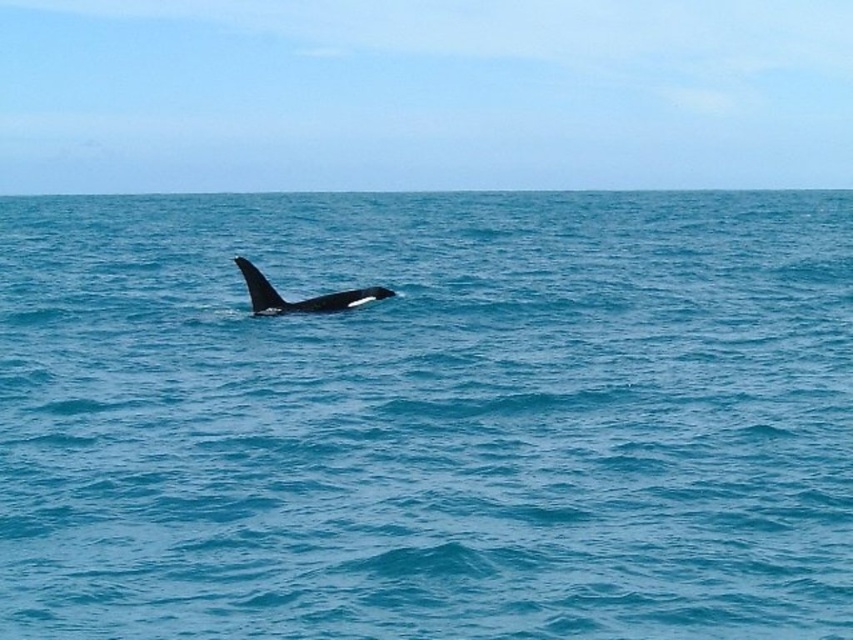
You are a marine biologist observing the ocean scene. You notice the blue water at center and the black smooth whale at center. How far apart are these two elements in the image?

The blue water at center and the black smooth whale at center are 28.91 meters apart from each other.

You are standing on a boat and see the blue water at center and the black smooth whale at center. Which object is positioned to the right of the other?

The blue water at center is to the right of the black smooth whale at center according to the description.